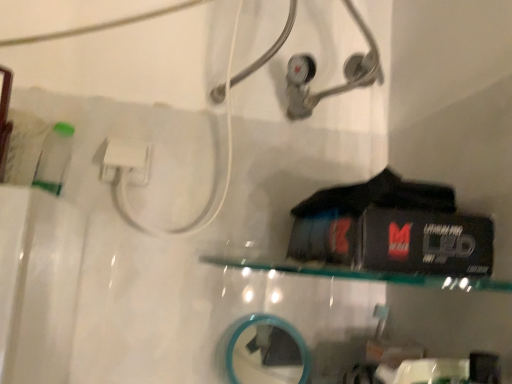
Locate an element on the screen. clear glass shelf at center is located at coordinates (364, 275).

What do you see at coordinates (364, 275) in the screenshot?
I see `clear glass shelf at center` at bounding box center [364, 275].

The height and width of the screenshot is (384, 512). What do you see at coordinates (267, 352) in the screenshot? I see `teal glass mirror at lower center` at bounding box center [267, 352].

In the scene shown: In order to face teal glass mirror at lower center, should I rotate leftwards or rightwards?

It's best to rotate right around 2.072 degrees.

The width and height of the screenshot is (512, 384). I want to click on teal glass mirror at lower center, so click(267, 352).

Locate an element on the screen. clear glass shelf at center is located at coordinates (364, 275).

Does clear glass shelf at center appear on the right side of teal glass mirror at lower center?

Correct, you'll find clear glass shelf at center to the right of teal glass mirror at lower center.

Which object is more forward, clear glass shelf at center or teal glass mirror at lower center?

clear glass shelf at center is closer to the camera.

Which is more distant, [273,265] or [275,361]?

Positioned behind is point [275,361].

From the image's perspective, which one is positioned lower, clear glass shelf at center or teal glass mirror at lower center?

teal glass mirror at lower center.

From a real-world perspective, relative to teal glass mirror at lower center, is clear glass shelf at center vertically above or below?

In terms of real-world spatial position, clear glass shelf at center is above teal glass mirror at lower center.

Considering the sizes of objects clear glass shelf at center and teal glass mirror at lower center in the image provided, who is thinner, clear glass shelf at center or teal glass mirror at lower center?

teal glass mirror at lower center.

Based on the photo, which of these two, clear glass shelf at center or teal glass mirror at lower center, stands shorter?

clear glass shelf at center is shorter.

Is clear glass shelf at center bigger than teal glass mirror at lower center?

Correct, clear glass shelf at center is larger in size than teal glass mirror at lower center.

Consider the image. Would you say clear glass shelf at center is outside teal glass mirror at lower center?

Indeed, clear glass shelf at center is completely outside teal glass mirror at lower center.

Is clear glass shelf at center in contact with teal glass mirror at lower center?

No, clear glass shelf at center is not touching teal glass mirror at lower center.

Is clear glass shelf at center oriented towards teal glass mirror at lower center?

No.

What's the angular difference between clear glass shelf at center and teal glass mirror at lower center's facing directions?

0.000535 degrees.

How distant is clear glass shelf at center from teal glass mirror at lower center?

23.19 centimeters.

Find the location of a particular element. The height and width of the screenshot is (384, 512). mirror located below the clear glass shelf at center (from the image's perspective) is located at coordinates (267, 352).

Looking at this image, is teal glass mirror at lower center to the left of clear glass shelf at center from the viewer's perspective?

Correct, you'll find teal glass mirror at lower center to the left of clear glass shelf at center.

Is teal glass mirror at lower center in front of clear glass shelf at center?

No, teal glass mirror at lower center is further to the viewer.

Which point is more distant from viewer, (x=239, y=370) or (x=354, y=279)?

Point (x=239, y=370)

From the image's perspective, does teal glass mirror at lower center appear higher than clear glass shelf at center?

No, from the image's perspective, teal glass mirror at lower center is not over clear glass shelf at center.

Based on the photo, from a real-world perspective, which is physically below, teal glass mirror at lower center or clear glass shelf at center?

teal glass mirror at lower center is physically lower.

Between teal glass mirror at lower center and clear glass shelf at center, which one has smaller width?

With smaller width is teal glass mirror at lower center.

From the picture: Does teal glass mirror at lower center have a greater height compared to clear glass shelf at center?

Correct, teal glass mirror at lower center is much taller as clear glass shelf at center.

Can you confirm if teal glass mirror at lower center is bigger than clear glass shelf at center?

Actually, teal glass mirror at lower center might be smaller than clear glass shelf at center.

In the scene shown: Is teal glass mirror at lower center positioned beyond the bounds of clear glass shelf at center?

teal glass mirror at lower center lies outside clear glass shelf at center's area.

Is there a large distance between teal glass mirror at lower center and clear glass shelf at center?

They are positioned close to each other.

Is teal glass mirror at lower center facing towards clear glass shelf at center?

No, teal glass mirror at lower center is not aimed at clear glass shelf at center.

How different are the orientations of teal glass mirror at lower center and clear glass shelf at center in degrees?

0.000535 degrees.

Identify the location of mirror on the left of clear glass shelf at center. (267, 352).

Where is `mirror located underneath the clear glass shelf at center (from a real-world perspective)`? Image resolution: width=512 pixels, height=384 pixels. mirror located underneath the clear glass shelf at center (from a real-world perspective) is located at coordinates (267, 352).

Where is `mirror on the left of clear glass shelf at center`? mirror on the left of clear glass shelf at center is located at coordinates (267, 352).